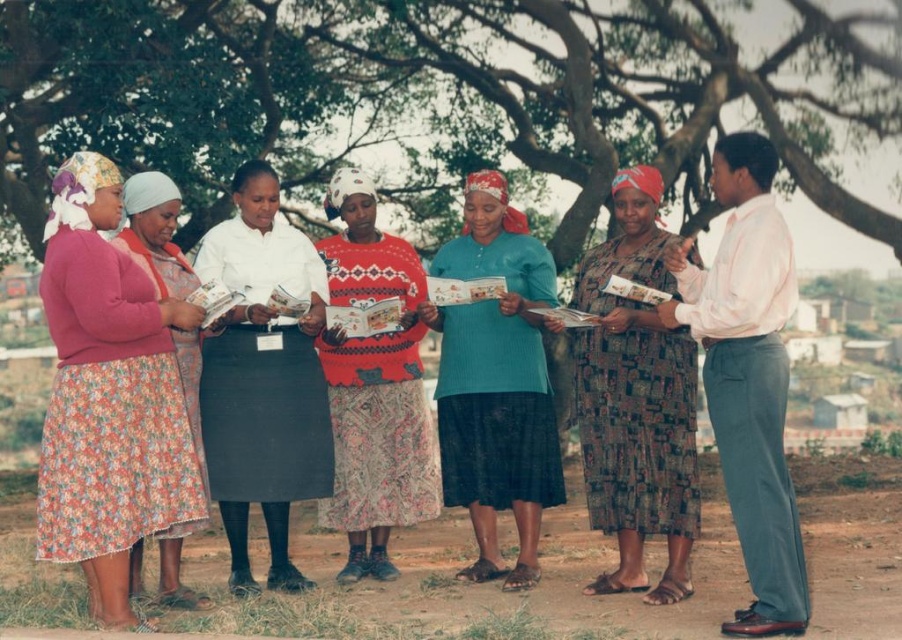
Question: Which object is the closest to the floral skirt at left?

Choices:
 (A) light pink cotton shirt at right
 (B) green leafy tree at upper center

Answer: (A)

Question: Which of the following is the closest to the observer?

Choices:
 (A) teal knitted sweater at center
 (B) floral skirt at left

Answer: (B)

Question: Is light pink cotton shirt at right smaller than teal knitted sweater at center?

Choices:
 (A) yes
 (B) no

Answer: (A)

Question: From the image, what is the correct spatial relationship of floral skirt at left in relation to knitted sweater at center?

Choices:
 (A) below
 (B) above

Answer: (A)

Question: Which object appears closest to the camera in this image?

Choices:
 (A) floral skirt at left
 (B) printed fabric dress at center

Answer: (A)

Question: In this image, where is floral skirt at left located relative to teal knitted sweater at center?

Choices:
 (A) right
 (B) left

Answer: (B)